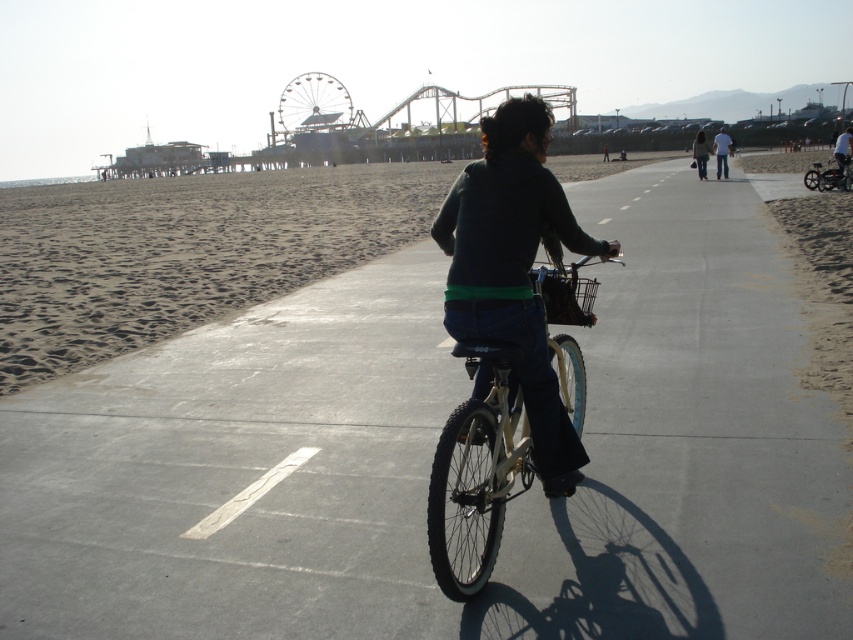
Question: Is metallic amusement park at upper center closer to camera compared to white fabric shirt at center?

Choices:
 (A) yes
 (B) no

Answer: (A)

Question: Can you confirm if metallic amusement park at upper center is positioned above light blue jeans at center?

Choices:
 (A) yes
 (B) no

Answer: (A)

Question: In this image, where is shiny metallic bicycle at right located relative to dark blue jeans at center?

Choices:
 (A) below
 (B) above

Answer: (A)

Question: Which object is farther from the camera taking this photo?

Choices:
 (A) dark green sweater at center
 (B) shiny metallic bicycle at center

Answer: (A)

Question: Which object appears farthest from the camera in this image?

Choices:
 (A) white fabric shirt at center
 (B) metallic amusement park at upper center
 (C) shiny metallic bicycle at right

Answer: (A)

Question: Which object is closer to the camera taking this photo?

Choices:
 (A) dark blue jeans at center
 (B) shiny metallic bicycle at right
 (C) sandy beach at center
 (D) light blue jeans at center

Answer: (C)